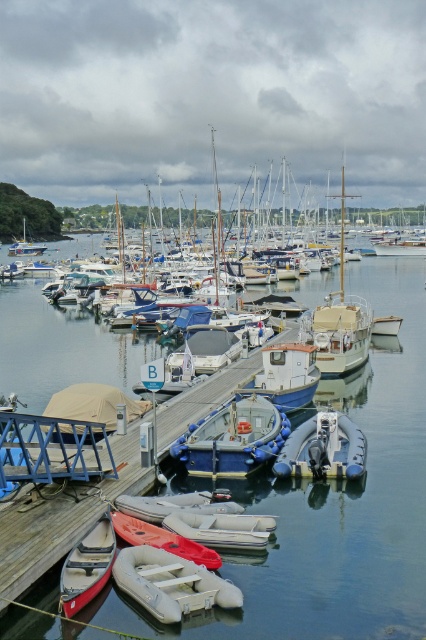
Who is shorter, clear water at center or white matte sailboat at center?

With less height is white matte sailboat at center.

At what (x,y) coordinates should I click in order to perform the action: click on clear water at center. Please return your answer as a coordinate pair (x, y). Looking at the image, I should click on (336, 506).

Looking at this image, is blue rubber dinghy at center thinner than wooden sailboat at center?

Yes.

Is point (279, 444) more distant than point (325, 372)?

No, (279, 444) is in front of (325, 372).

Find the location of a particular element. blue rubber dinghy at center is located at coordinates (233, 438).

Is gray rubber dinghy at lower center closer to the viewer compared to rubber dinghy at lower center?

Yes, it is in front of rubber dinghy at lower center.

Can you confirm if gray rubber dinghy at lower center is positioned above rubber dinghy at lower center?

No.

The width and height of the screenshot is (426, 640). What do you see at coordinates (170, 582) in the screenshot?
I see `gray rubber dinghy at lower center` at bounding box center [170, 582].

Where is `gray rubber dinghy at lower center`? The image size is (426, 640). gray rubber dinghy at lower center is located at coordinates (170, 582).